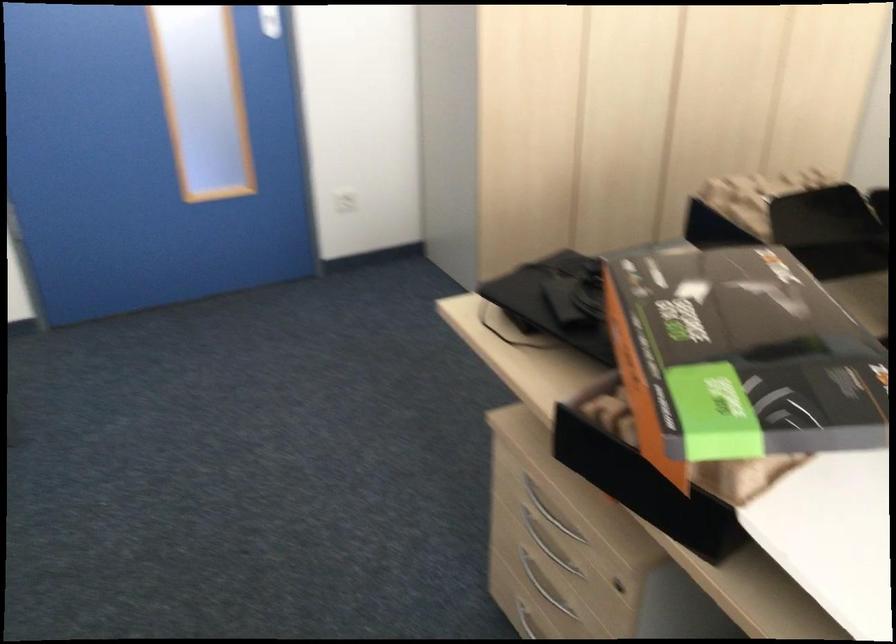
Where is `large cardboard box`? large cardboard box is located at coordinates (738, 357).